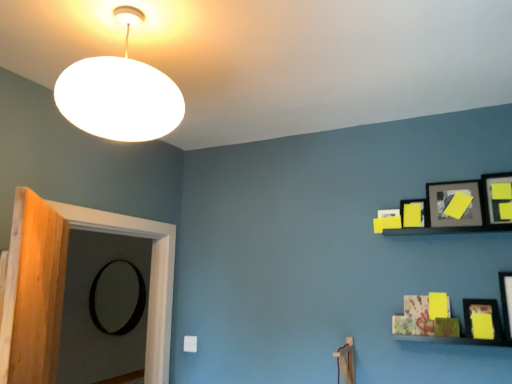
Question: Is matte black picture frame at upper right, the 2th picture frame positioned from the left, positioned in front of wooden door at left?

Choices:
 (A) yes
 (B) no

Answer: (B)

Question: Does matte black picture frame at upper right, the 5th picture frame in the front-to-back sequence, have a smaller size compared to wooden door at left?

Choices:
 (A) yes
 (B) no

Answer: (A)

Question: From a real-world perspective, is matte black picture frame at upper right, the second picture frame from the back, positioned over wooden door at left based on gravity?

Choices:
 (A) no
 (B) yes

Answer: (B)

Question: Is matte black picture frame at upper right, placed as the third picture frame when sorted from top to bottom, not inside wooden door at left?

Choices:
 (A) no
 (B) yes

Answer: (B)

Question: From the image's perspective, is matte black picture frame at upper right, which is the 4th picture frame in bottom-to-top order, located above wooden door at left?

Choices:
 (A) no
 (B) yes

Answer: (B)

Question: Is white matte lampshade at upper left wider or thinner than wooden door at left?

Choices:
 (A) wide
 (B) thin

Answer: (A)

Question: Considering the positions of white matte lampshade at upper left and wooden door at left in the image, is white matte lampshade at upper left taller or shorter than wooden door at left?

Choices:
 (A) short
 (B) tall

Answer: (A)

Question: Considering the relative positions of white matte lampshade at upper left and wooden door at left in the image provided, is white matte lampshade at upper left to the left or to the right of wooden door at left?

Choices:
 (A) left
 (B) right

Answer: (B)

Question: Considering their positions, is white matte lampshade at upper left located in front of or behind wooden door at left?

Choices:
 (A) behind
 (B) front

Answer: (B)

Question: From a real-world perspective, is black matte picture frame at left, which ranks as the 1th picture frame in bottom-to-top order, above or below wooden door at left?

Choices:
 (A) below
 (B) above

Answer: (A)

Question: Is black matte picture frame at left, which ranks as the first picture frame in back-to-front order, taller or shorter than wooden door at left?

Choices:
 (A) tall
 (B) short

Answer: (B)

Question: Considering the positions of black matte picture frame at left, the 6th picture frame viewed from the top, and wooden door at left in the image, is black matte picture frame at left, the 6th picture frame viewed from the top, wider or thinner than wooden door at left?

Choices:
 (A) thin
 (B) wide

Answer: (A)

Question: From the image's perspective, relative to wooden door at left, is black matte picture frame at left, which ranks as the 1th picture frame in bottom-to-top order, above or below?

Choices:
 (A) above
 (B) below

Answer: (B)

Question: From a real-world perspective, is wooden door at left physically located above or below yellow matte picture frame at upper right, which is the fifth picture frame from left to right?

Choices:
 (A) below
 (B) above

Answer: (A)

Question: Would you say wooden door at left is inside or outside yellow matte picture frame at upper right, acting as the 4th picture frame starting from the back?

Choices:
 (A) inside
 (B) outside

Answer: (B)